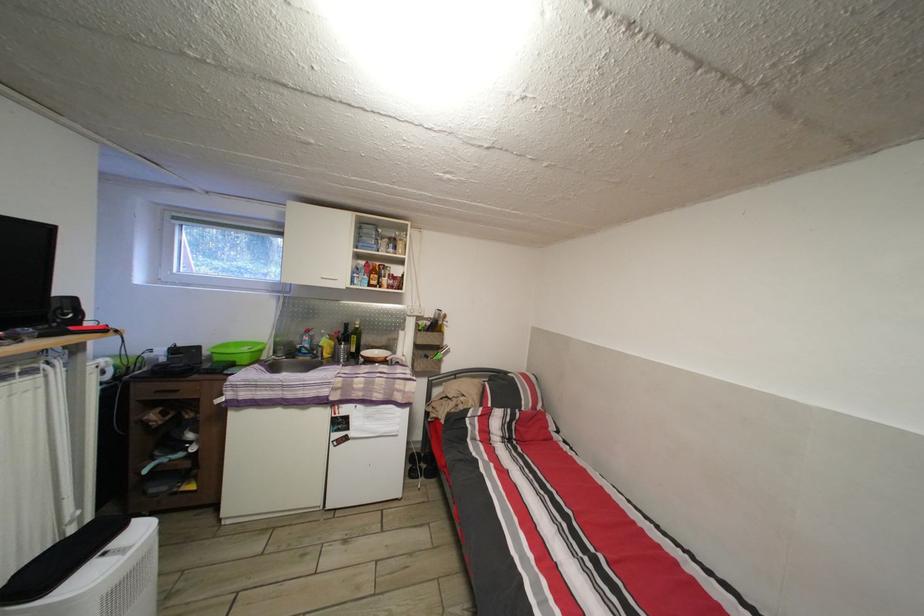
What do you see at coordinates (168, 390) in the screenshot?
I see `the drawer handle` at bounding box center [168, 390].